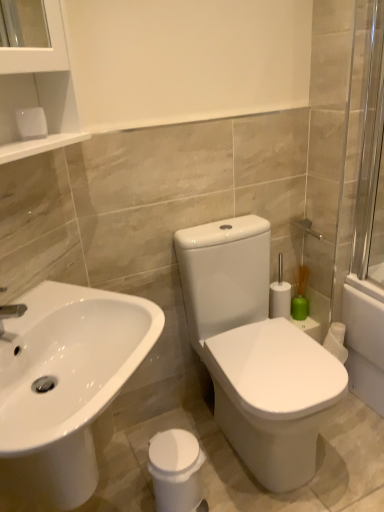
Question: Would you consider green matte vase at right to be distant from white glossy sink at lower left?

Choices:
 (A) yes
 (B) no

Answer: (A)

Question: Is green matte vase at right to the right of white glossy sink at lower left from the viewer's perspective?

Choices:
 (A) no
 (B) yes

Answer: (B)

Question: Does green matte vase at right have a lesser width compared to white glossy sink at lower left?

Choices:
 (A) no
 (B) yes

Answer: (B)

Question: Can you confirm if green matte vase at right is taller than white glossy sink at lower left?

Choices:
 (A) yes
 (B) no

Answer: (B)

Question: Is white glossy sink at lower left completely or partially inside green matte vase at right?

Choices:
 (A) no
 (B) yes

Answer: (A)

Question: Does green matte vase at right come behind white glossy sink at lower left?

Choices:
 (A) yes
 (B) no

Answer: (A)

Question: Is transparent glass screen door at right outside of white glossy trash can at lower center?

Choices:
 (A) yes
 (B) no

Answer: (A)

Question: From a real-world perspective, is transparent glass screen door at right physically below white glossy trash can at lower center?

Choices:
 (A) no
 (B) yes

Answer: (A)

Question: Can you see transparent glass screen door at right touching white glossy trash can at lower center?

Choices:
 (A) no
 (B) yes

Answer: (A)

Question: From a real-world perspective, is transparent glass screen door at right on white glossy trash can at lower center?

Choices:
 (A) yes
 (B) no

Answer: (A)

Question: Are transparent glass screen door at right and white glossy trash can at lower center far apart?

Choices:
 (A) yes
 (B) no

Answer: (A)

Question: Can you confirm if transparent glass screen door at right is positioned to the left of white glossy trash can at lower center?

Choices:
 (A) no
 (B) yes

Answer: (A)

Question: From the image's perspective, is green matte vase at right below white glossy trash can at lower center?

Choices:
 (A) no
 (B) yes

Answer: (A)